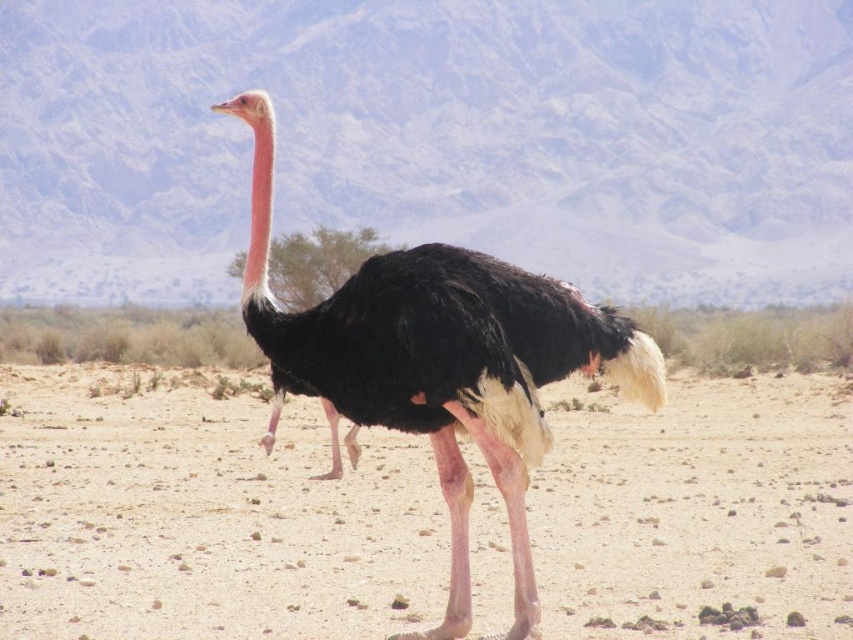
Is point (606, 573) positioned behind point (346, 316)?

Yes, point (606, 573) is farther from viewer.

Who is taller, brown sandy dirt at center or black feathered ostrich at center?

Standing taller between the two is black feathered ostrich at center.

Who is more forward, (657, 488) or (360, 420)?

Point (360, 420) is more forward.

This screenshot has height=640, width=853. What are the coordinates of `brown sandy dirt at center` in the screenshot? It's located at (202, 520).

Is black feathered ostrich at center to the left of white matte head at center from the viewer's perspective?

Incorrect, black feathered ostrich at center is not on the left side of white matte head at center.

Who is shorter, black feathered ostrich at center or white matte head at center?

With less height is black feathered ostrich at center.

Describe the element at coordinates (448, 369) in the screenshot. I see `black feathered ostrich at center` at that location.

At what (x,y) coordinates should I click in order to perform the action: click on black feathered ostrich at center. Please return your answer as a coordinate pair (x, y). The height and width of the screenshot is (640, 853). Looking at the image, I should click on (448, 369).

Is brown sandy dirt at center below white matte head at center?

Correct, brown sandy dirt at center is located below white matte head at center.

Does point (73, 614) lie behind point (271, 128)?

Yes, it is behind point (271, 128).

Between point (775, 417) and point (254, 132), which one is positioned behind?

Positioned behind is point (775, 417).

Image resolution: width=853 pixels, height=640 pixels. I want to click on brown sandy dirt at center, so [202, 520].